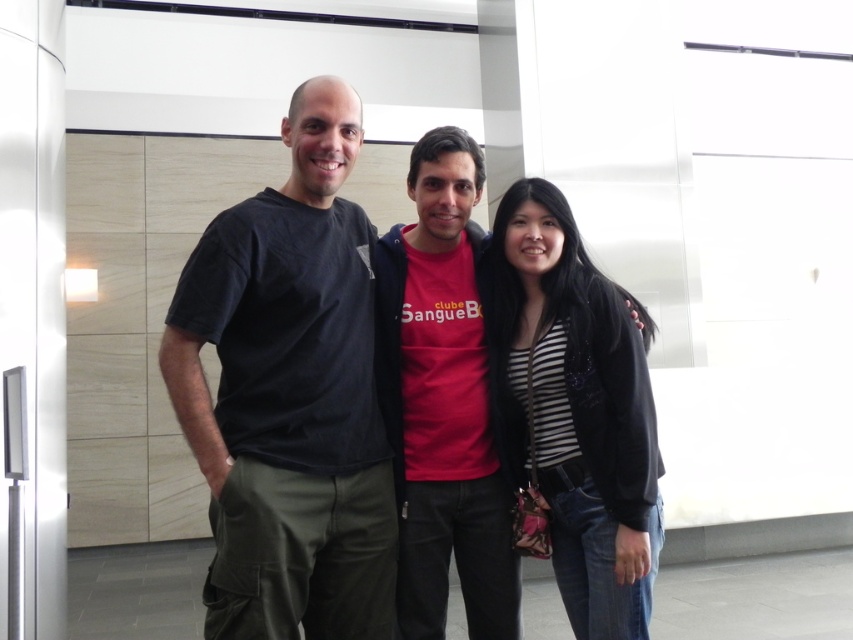
Question: Is matte black t-shirt at center to the left of dark gray cotton t-shirt at center from the viewer's perspective?

Choices:
 (A) yes
 (B) no

Answer: (B)

Question: Which of these objects is positioned closest to the dark gray cotton t-shirt at center?

Choices:
 (A) matte black t-shirt at center
 (B) matte red t-shirt at center

Answer: (A)

Question: Can you confirm if striped fabric jacket at center is positioned below matte red t-shirt at center?

Choices:
 (A) yes
 (B) no

Answer: (A)

Question: Among these objects, which one is farthest from the camera?

Choices:
 (A) matte red t-shirt at center
 (B) dark gray cotton t-shirt at center

Answer: (A)

Question: Can you confirm if matte black t-shirt at center is positioned below dark gray cotton t-shirt at center?

Choices:
 (A) yes
 (B) no

Answer: (A)

Question: Which point appears closest to the camera in this image?

Choices:
 (A) (380, 625)
 (B) (399, 403)
 (C) (430, 532)

Answer: (A)